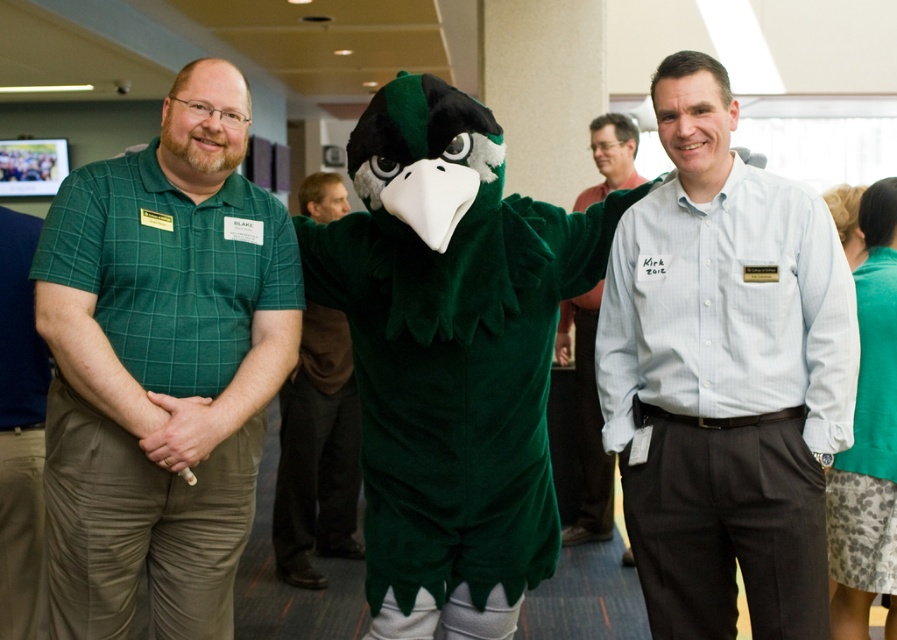
Between green plush mascot at center and light blue shirt at center, which one appears on the left side from the viewer's perspective?

Positioned to the left is green plush mascot at center.

Who is higher up, green plush mascot at center or light blue shirt at center?

light blue shirt at center is higher up.

The height and width of the screenshot is (640, 897). What are the coordinates of `green plush mascot at center` in the screenshot? It's located at (318, 452).

You are a GUI agent. You are given a task and a screenshot of the screen. Output one action in this format:
    pyautogui.click(x=<x>, y=<y>)
    Task: Click on the green plush mascot at center
    The height and width of the screenshot is (640, 897).
    Given the screenshot: What is the action you would take?
    pyautogui.click(x=318, y=452)

Between point (151, 502) and point (895, 332), which one is positioned in front?

Point (151, 502)

The image size is (897, 640). What do you see at coordinates (161, 365) in the screenshot?
I see `green plaid shirt at left` at bounding box center [161, 365].

Measure the distance between green plaid shirt at left and camera.

6.64 feet

This screenshot has height=640, width=897. Find the location of `green plaid shirt at left`. green plaid shirt at left is located at coordinates (161, 365).

Does point (84, 305) lie behind point (594, 337)?

No.

At what (x,y) coordinates should I click in order to perform the action: click on green plaid shirt at left. Please return your answer as a coordinate pair (x, y). The width and height of the screenshot is (897, 640). Looking at the image, I should click on (161, 365).

The height and width of the screenshot is (640, 897). In order to click on green plaid shirt at left in this screenshot , I will do `click(161, 365)`.